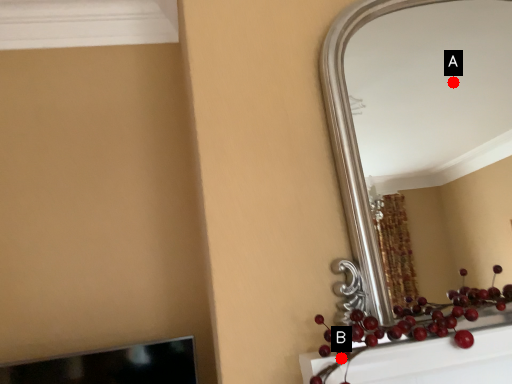
Question: Two points are circled on the image, labeled by A and B beside each circle. Which point appears closest to the camera in this image?

Choices:
 (A) A is closer
 (B) B is closer

Answer: (B)